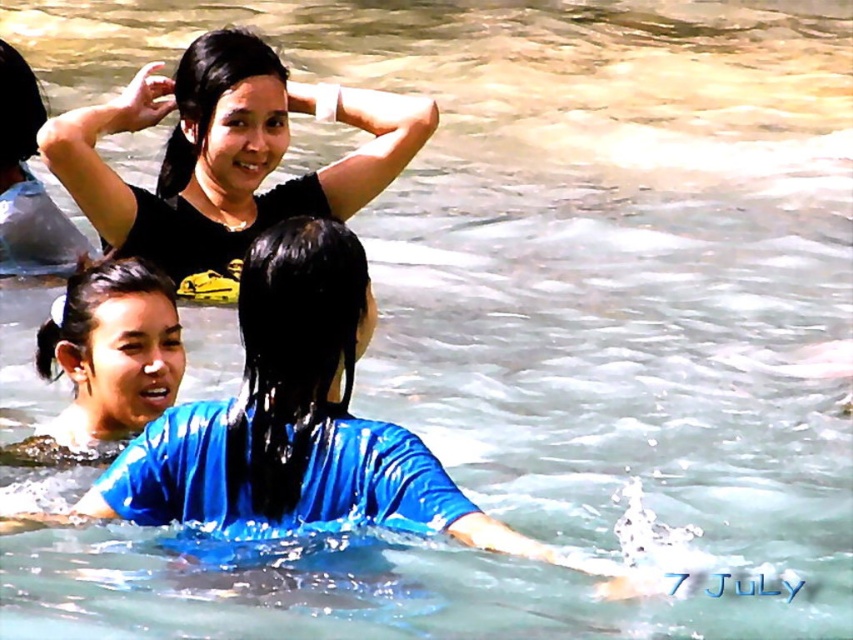
Question: Which object is the farthest from the white glossy hair at center?

Choices:
 (A) black matte shirt at upper center
 (B) blue glossy shirt at center

Answer: (A)

Question: Which object is farther from the camera taking this photo?

Choices:
 (A) white glossy hair at center
 (B) black matte shirt at upper center

Answer: (B)

Question: In this image, where is blue glossy shirt at center located relative to black matte shirt at upper center?

Choices:
 (A) left
 (B) right

Answer: (B)

Question: Among these points, which one is nearest to the camera?

Choices:
 (A) (129, 520)
 (B) (273, 196)
 (C) (13, 451)

Answer: (A)

Question: Is black matte shirt at upper center to the right of white glossy hair at center from the viewer's perspective?

Choices:
 (A) no
 (B) yes

Answer: (B)

Question: Is black matte shirt at upper center wider than white glossy hair at center?

Choices:
 (A) no
 (B) yes

Answer: (B)